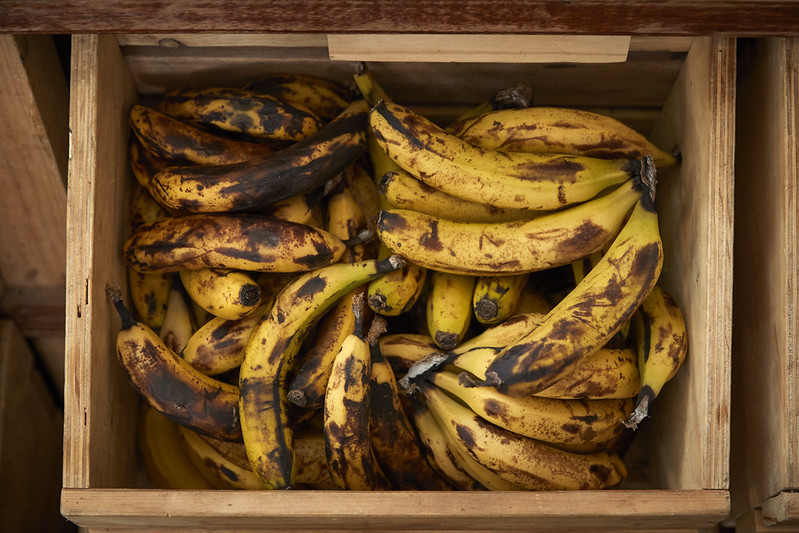
This screenshot has width=799, height=533. I want to click on shelf, so click(x=154, y=15), click(x=29, y=240).